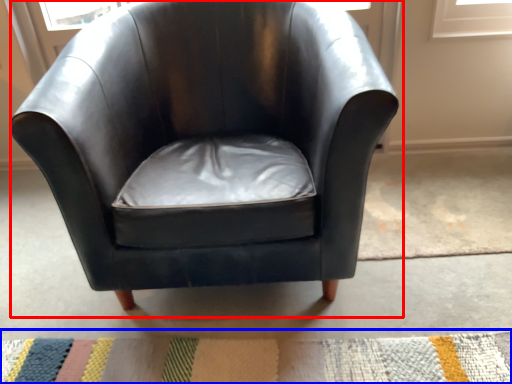
Question: Which of the following is the closest to the observer, chair (highlighted by a red box) or doormat (highlighted by a blue box)?

Choices:
 (A) chair
 (B) doormat

Answer: (A)